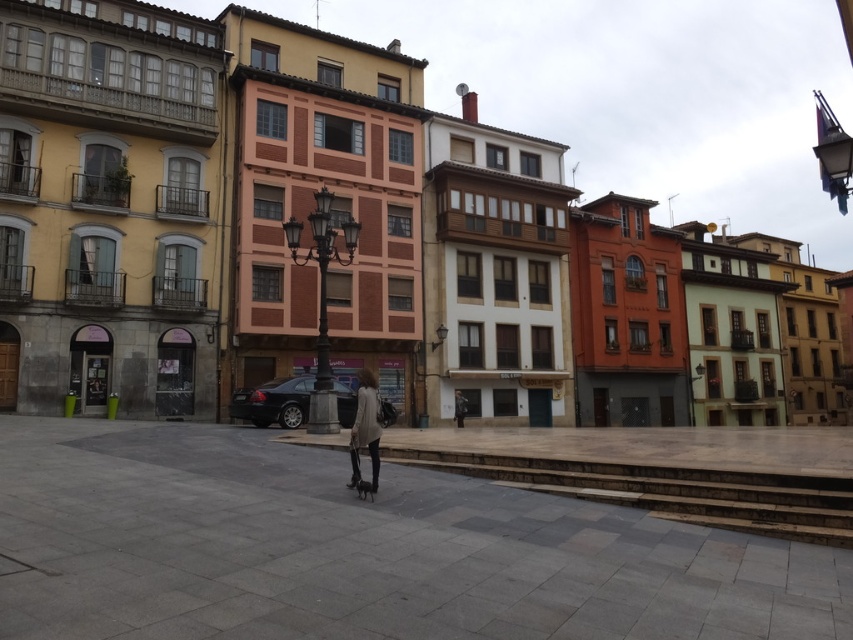
Question: In this image, where is light beige sweater at center located relative to dark gray fabric jacket at center?

Choices:
 (A) right
 (B) left

Answer: (B)

Question: Is light beige sweater at center behind dark gray fabric jacket at center?

Choices:
 (A) yes
 (B) no

Answer: (B)

Question: Among these points, which one is nearest to the camera?

Choices:
 (A) (360, 433)
 (B) (461, 419)

Answer: (A)

Question: Among these objects, which one is nearest to the camera?

Choices:
 (A) light beige sweater at center
 (B) dark gray fabric jacket at center

Answer: (A)

Question: Does light beige sweater at center have a lesser width compared to dark gray fabric jacket at center?

Choices:
 (A) yes
 (B) no

Answer: (B)